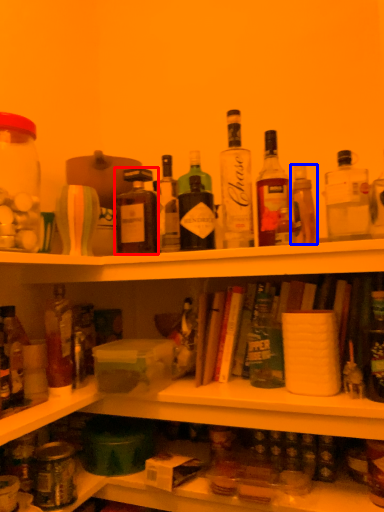
Question: Which of the following is the farthest to the observer, bottle (highlighted by a red box) or bottle (highlighted by a blue box)?

Choices:
 (A) bottle
 (B) bottle

Answer: (A)